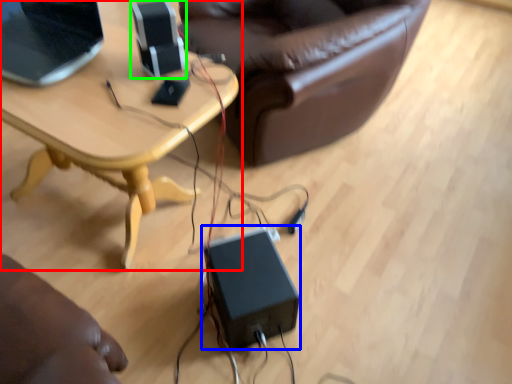
Question: Considering the real-world distances, which object is closest to table (highlighted by a red box)? speaker (highlighted by a blue box) or speaker (highlighted by a green box).

Choices:
 (A) speaker
 (B) speaker

Answer: (B)